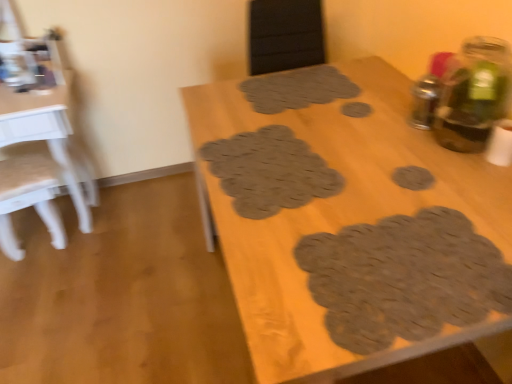
At what (x,y) coordinates should I click in order to perform the action: click on free spot to the right of brown textured mat at center, positioned as the 3th footprint in top-to-bottom order. Please return your answer as a coordinate pair (x, y). Image resolution: width=512 pixels, height=384 pixels. Looking at the image, I should click on (380, 159).